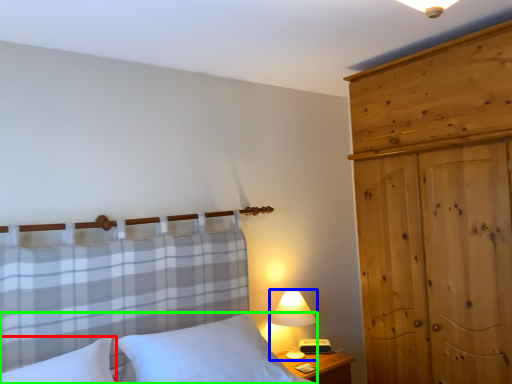
Question: Which is nearer to the pillow (highlighted by a red box)? table lamp (highlighted by a blue box) or bed (highlighted by a green box).

Choices:
 (A) table lamp
 (B) bed

Answer: (B)